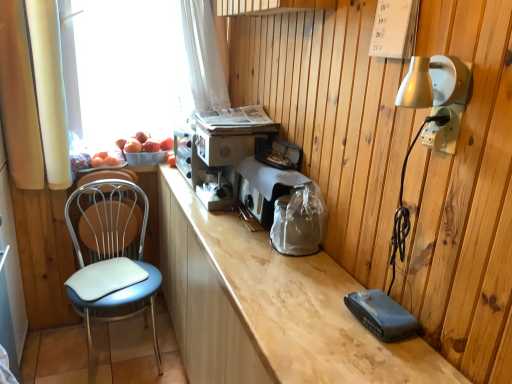
The width and height of the screenshot is (512, 384). I want to click on blue padded seat at left, so click(x=112, y=251).

Describe the element at coordinates (128, 69) in the screenshot. The width and height of the screenshot is (512, 384). I see `transparent plastic basket at upper left` at that location.

What is the approximate height of metallic silver toaster at center?

10.18 inches.

The height and width of the screenshot is (384, 512). I want to click on white fabric curtain at left, so click(50, 90).

Find the location of `metallic silver coffee machine at center`. metallic silver coffee machine at center is located at coordinates (220, 150).

Is metallic silver toaster at center spatially inside white fabric curtain at left, or outside of it?

metallic silver toaster at center is located beyond the bounds of white fabric curtain at left.

From a real-world perspective, is metallic silver toaster at center under white fabric curtain at left?

Yes, from a real-world perspective, metallic silver toaster at center is below white fabric curtain at left.

Identify the location of curtain lying above the metallic silver toaster at center (from the image's perspective). (50, 90).

From a real-world perspective, is transparent plastic basket at upper left positioned over white paper calendar at upper right based on gravity?

No, from a real-world perspective, transparent plastic basket at upper left is not over white paper calendar at upper right

In the scene shown: Measure the distance from transparent plastic basket at upper left to white paper calendar at upper right.

transparent plastic basket at upper left and white paper calendar at upper right are 4.99 feet apart from each other.

From the picture: From the image's perspective, would you say transparent plastic basket at upper left is positioned over white paper calendar at upper right?

Yes, from the image's perspective, transparent plastic basket at upper left is above white paper calendar at upper right.

Between transparent plastic basket at upper left and white paper calendar at upper right, which one has smaller size?

With smaller size is white paper calendar at upper right.

Considering the sizes of objects metallic silver coffee machine at center and metallic silver toaster at center in the image provided, who is shorter, metallic silver coffee machine at center or metallic silver toaster at center?

With less height is metallic silver toaster at center.

Considering the relative positions of metallic silver coffee machine at center and metallic silver toaster at center in the image provided, is metallic silver coffee machine at center to the left or to the right of metallic silver toaster at center?

Based on their positions, metallic silver coffee machine at center is located to the left of metallic silver toaster at center.

I want to click on appliance lying on the right of metallic silver coffee machine at center, so click(265, 187).

Which object is wider, white paper calendar at upper right or metallic silver toaster at center?

Wider between the two is metallic silver toaster at center.

Could metallic silver toaster at center be considered to be inside white paper calendar at upper right?

No, white paper calendar at upper right does not contain metallic silver toaster at center.

In the scene shown: From a real-world perspective, which is physically below, white paper calendar at upper right or metallic silver toaster at center?

From a 3D spatial view, metallic silver toaster at center is below.

From the image's perspective, between white paper calendar at upper right and metallic silver toaster at center, which one is located above?

From the image's view, white paper calendar at upper right is above.

Considering the relative sizes of metallic silver coffee machine at center and blue padded seat at left in the image provided, is metallic silver coffee machine at center thinner than blue padded seat at left?

Correct, the width of metallic silver coffee machine at center is less than that of blue padded seat at left.

From the image's perspective, is metallic silver coffee machine at center located beneath blue padded seat at left?

No, from the image's perspective, metallic silver coffee machine at center is not beneath blue padded seat at left.

Is metallic silver coffee machine at center beside blue padded seat at left?

There is a gap between metallic silver coffee machine at center and blue padded seat at left.

Looking at this image, what's the angular difference between metallic silver coffee machine at center and blue padded seat at left's facing directions?

The facing directions of metallic silver coffee machine at center and blue padded seat at left are 89.7 degrees apart.

Identify the location of armchair below the metallic silver coffee machine at center (from the image's perspective). (109, 220).

From the image's perspective, is white leather chair at left located above or below metallic silver coffee machine at center?

Clearly, from the image's perspective, white leather chair at left is below metallic silver coffee machine at center.

Which is behind, point (126, 208) or point (231, 179)?

The point (126, 208) is more distant.

From the picture: Which of these two, white leather chair at left or metallic silver coffee machine at center, is bigger?

metallic silver coffee machine at center.

Is white paper calendar at upper right completely or partially outside of blue padded seat at left?

Yes, white paper calendar at upper right is outside of blue padded seat at left.

Can you see white paper calendar at upper right touching blue padded seat at left?

No, white paper calendar at upper right is not making contact with blue padded seat at left.

How different are the orientations of white paper calendar at upper right and blue padded seat at left in degrees?

92.1 degrees separate the facing orientations of white paper calendar at upper right and blue padded seat at left.

From the image's perspective, is white paper calendar at upper right under blue padded seat at left?

No, from the image's perspective, white paper calendar at upper right is not beneath blue padded seat at left.

At what (x,y) coordinates should I click in order to perform the action: click on curtain behind the metallic silver toaster at center. Please return your answer as a coordinate pair (x, y). Looking at the image, I should click on (50, 90).

Identify the location of window screen that is on the left side of white paper calendar at upper right. This screenshot has height=384, width=512. (128, 69).

Looking at the image, which one is located further to white paper calendar at upper right, white plastic electrical outlet at upper right or metallic silver toaster at center?

Among the two, metallic silver toaster at center is located further to white paper calendar at upper right.

From the image, which object appears to be nearer to white paper calendar at upper right, metallic silver coffee machine at center or metallic silver toaster at center?

metallic silver toaster at center is positioned closer to the anchor white paper calendar at upper right.

From the image, which object appears to be farther from metallic silver coffee machine at center, metallic silver toaster at center or transparent plastic basket at upper left?

transparent plastic basket at upper left.

Based on their spatial positions, is metallic silver coffee machine at center or transparent plastic basket at upper left closer to white plastic electrical outlet at upper right?

Based on the image, metallic silver coffee machine at center appears to be nearer to white plastic electrical outlet at upper right.

Which object lies nearer to the anchor point white leather chair at left, blue padded seat at left or white paper calendar at upper right?

Among the two, blue padded seat at left is located nearer to white leather chair at left.

Estimate the real-world distances between objects in this image. Which object is closer to blue padded seat at left, white paper calendar at upper right or white fabric curtain at left?

Based on the image, white fabric curtain at left appears to be nearer to blue padded seat at left.

Based on their spatial positions, is white paper calendar at upper right or metallic silver toaster at center further from blue padded seat at left?

The object further to blue padded seat at left is white paper calendar at upper right.

Looking at the image, which one is located further to white fabric curtain at left, white plastic electrical outlet at upper right or metallic silver coffee machine at center?

The object further to white fabric curtain at left is white plastic electrical outlet at upper right.

The image size is (512, 384). I want to click on chair located between white fabric curtain at left and white paper calendar at upper right in the left-right direction, so click(112, 251).

Where is `window screen between white leather chair at left and metallic silver toaster at center`? This screenshot has width=512, height=384. window screen between white leather chair at left and metallic silver toaster at center is located at coordinates (128, 69).

At what (x,y) coordinates should I click in order to perform the action: click on chair between white fabric curtain at left and metallic silver coffee machine at center. Please return your answer as a coordinate pair (x, y). The height and width of the screenshot is (384, 512). Looking at the image, I should click on (112, 251).

I want to click on window screen located between white fabric curtain at left and metallic silver coffee machine at center in the left-right direction, so coord(128,69).